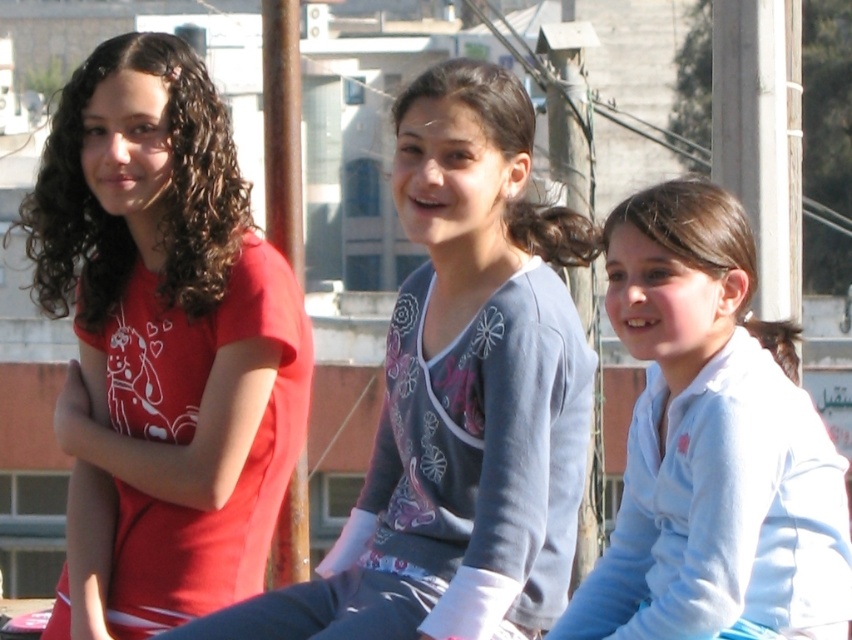
Is point (87, 326) positioned before point (424, 634)?

No.

Is matte red t-shirt at left to the left of matte pink shirt at center from the viewer's perspective?

Indeed, matte red t-shirt at left is positioned on the left side of matte pink shirt at center.

Between point (153, 145) and point (501, 627), which one is positioned behind?

Positioned behind is point (153, 145).

At what (x,y) coordinates should I click in order to perform the action: click on matte red t-shirt at left. Please return your answer as a coordinate pair (x, y). Looking at the image, I should click on (162, 344).

Between matte pink shirt at center and white fleece jacket at lower right, which one is positioned lower?

Positioned lower is white fleece jacket at lower right.

Who is taller, matte pink shirt at center or white fleece jacket at lower right?

Standing taller between the two is matte pink shirt at center.

Who is more forward, (544, 496) or (648, 490)?

Point (544, 496) is in front.

I want to click on matte pink shirt at center, so click(x=459, y=397).

Can you confirm if matte red t-shirt at left is positioned to the right of white fleece jacket at lower right?

In fact, matte red t-shirt at left is to the left of white fleece jacket at lower right.

Is matte red t-shirt at left positioned in front of white fleece jacket at lower right?

No, it is behind white fleece jacket at lower right.

What do you see at coordinates (162, 344) in the screenshot?
I see `matte red t-shirt at left` at bounding box center [162, 344].

The width and height of the screenshot is (852, 640). I want to click on matte red t-shirt at left, so click(162, 344).